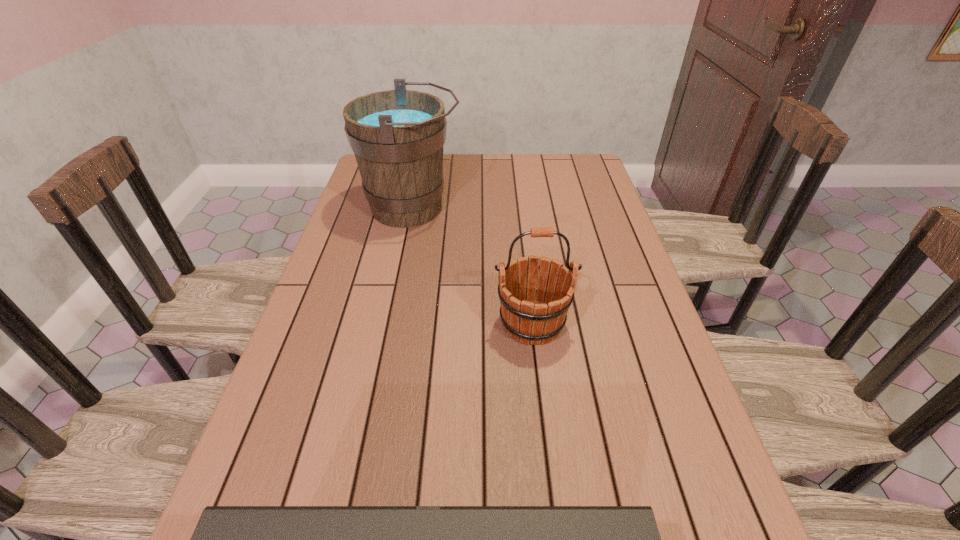
At what (x,y) coordinates should I click in order to perform the action: click on the closest object to the left wine bucket. Please return your answer as a coordinate pair (x, y). The image size is (960, 540). Looking at the image, I should click on (529, 321).

Where is `free region that satisfies the following two spatial constraints: 1. with a handle on the side of the left wine bucket; 2. on the left side of the right wine bucket`? The width and height of the screenshot is (960, 540). free region that satisfies the following two spatial constraints: 1. with a handle on the side of the left wine bucket; 2. on the left side of the right wine bucket is located at coordinates (389, 323).

This screenshot has height=540, width=960. I want to click on free region that satisfies the following two spatial constraints: 1. with a handle on the side of the left wine bucket; 2. on the back side of the nearer wine bucket, so click(x=389, y=323).

Image resolution: width=960 pixels, height=540 pixels. What are the coordinates of `vacant space that satisfies the following two spatial constraints: 1. on the back side of the nearer wine bucket; 2. with a handle on the side of the farthest object` in the screenshot? It's located at (518, 208).

Locate an element on the screen. This screenshot has width=960, height=540. vacant space that satisfies the following two spatial constraints: 1. with a handle on the side of the second farthest object; 2. on the left side of the taller wine bucket is located at coordinates (389, 323).